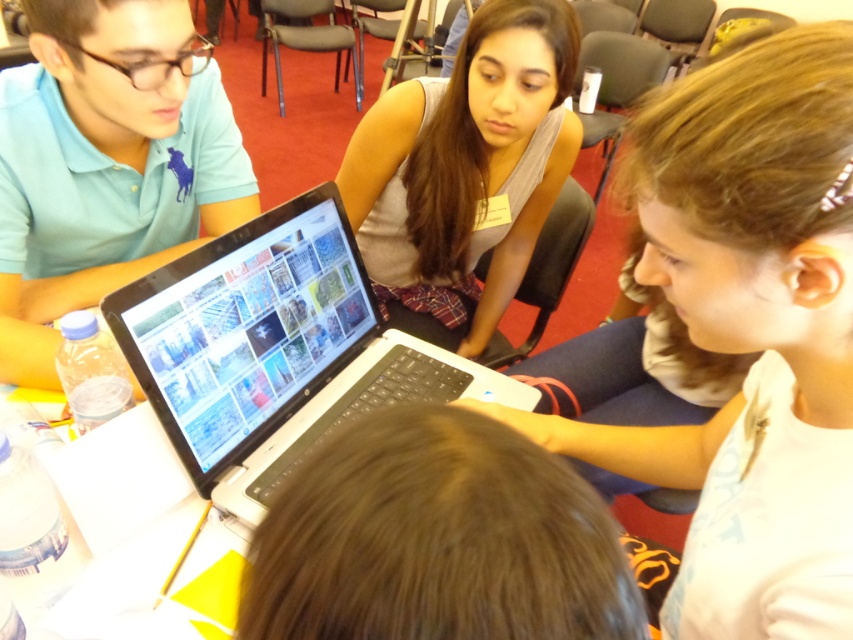
Who is positioned more to the left, white plastic laptop at center or matte blue polo shirt at left?

matte blue polo shirt at left is more to the left.

Does white plastic laptop at center appear on the left side of matte blue polo shirt at left?

Incorrect, white plastic laptop at center is not on the left side of matte blue polo shirt at left.

Is point (335, 403) behind point (178, 192)?

No, (335, 403) is in front of (178, 192).

You are a GUI agent. You are given a task and a screenshot of the screen. Output one action in this format:
    pyautogui.click(x=<x>, y=<y>)
    Task: Click on the white plastic laptop at center
    Image resolution: width=853 pixels, height=640 pixels.
    Given the screenshot: What is the action you would take?
    pyautogui.click(x=271, y=349)

This screenshot has height=640, width=853. What do you see at coordinates (436, 540) in the screenshot? I see `brown hair at center` at bounding box center [436, 540].

Between point (546, 502) and point (148, 289), which one is positioned in front?

Positioned in front is point (546, 502).

Image resolution: width=853 pixels, height=640 pixels. Find the location of `brown hair at center`. brown hair at center is located at coordinates (436, 540).

Consider the image. Between white matte laptop at center and matte gray shirt at center, which one has more height?

With more height is matte gray shirt at center.

Is white matte laptop at center to the right of matte gray shirt at center from the viewer's perspective?

Yes, white matte laptop at center is to the right of matte gray shirt at center.

Describe the element at coordinates (747, 332) in the screenshot. I see `white matte laptop at center` at that location.

Where is `white matte laptop at center`? white matte laptop at center is located at coordinates (747, 332).